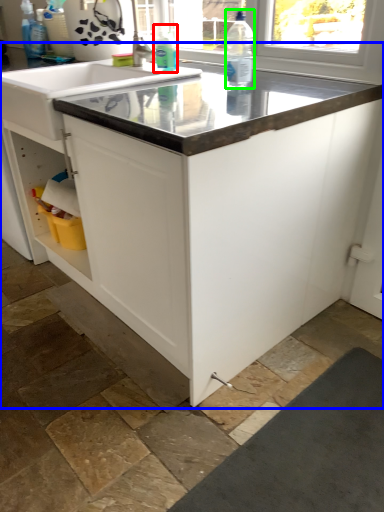
Question: Which object is the closest to the cleaning product (highlighted by a red box)? Choose among these: countertop (highlighted by a blue box) or bottle (highlighted by a green box).

Choices:
 (A) countertop
 (B) bottle

Answer: (B)